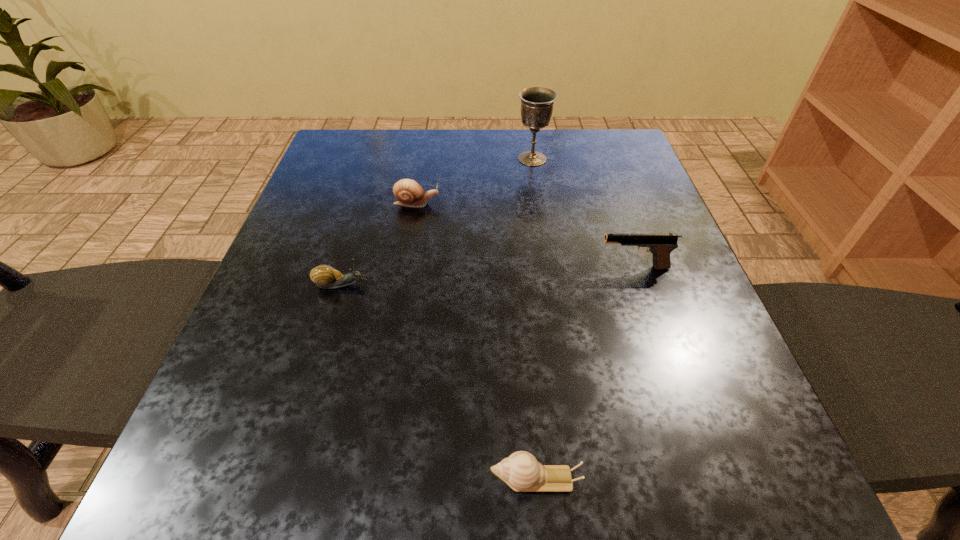
Locate an element on the screen. object at the near edge is located at coordinates (521, 471).

I want to click on object that is at the left edge, so click(x=325, y=276).

Find the location of a particular element. object situated at the right edge is located at coordinates (660, 245).

You are a GUI agent. You are given a task and a screenshot of the screen. Output one action in this format:
    pyautogui.click(x=<x>, y=<y>)
    Task: Click on the vacant space at the far edge of the desktop
    
    Given the screenshot: What is the action you would take?
    pyautogui.click(x=465, y=174)

In the image, there is a desktop. At what (x,y) coordinates should I click in order to perform the action: click on vacant space at the near edge. Please return your answer as a coordinate pair (x, y). This screenshot has width=960, height=540. Looking at the image, I should click on (625, 516).

Where is `free spot at the left edge of the desktop`? free spot at the left edge of the desktop is located at coordinates (307, 200).

The height and width of the screenshot is (540, 960). Identify the location of vacant region at the right edge of the desktop. (669, 308).

Locate an element on the screen. The image size is (960, 540). free space at the near left corner of the desktop is located at coordinates (235, 498).

Where is `blank space at the far right corner of the desktop`? The width and height of the screenshot is (960, 540). blank space at the far right corner of the desktop is located at coordinates (586, 136).

This screenshot has height=540, width=960. I want to click on empty space that is in between the farthest escargot and the rightmost object, so click(525, 235).